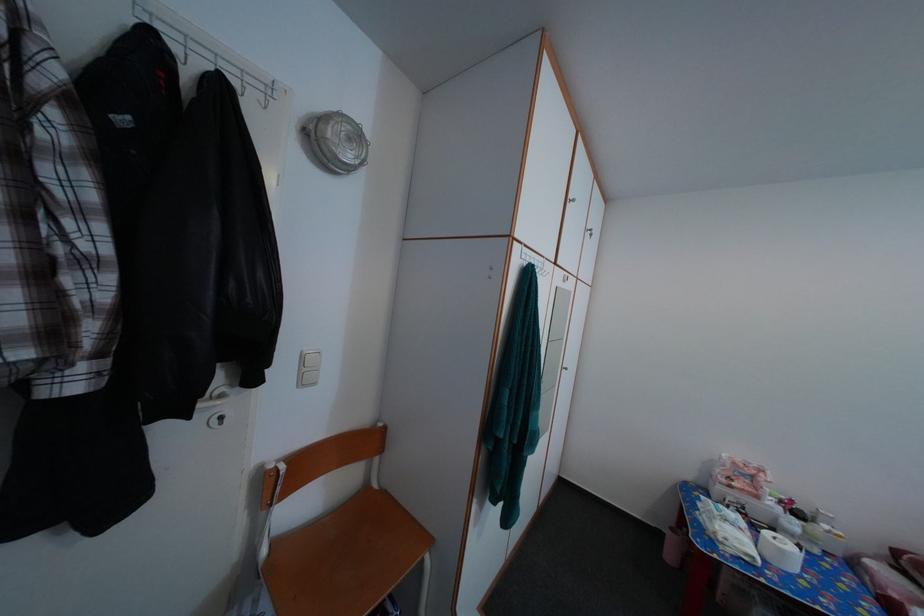
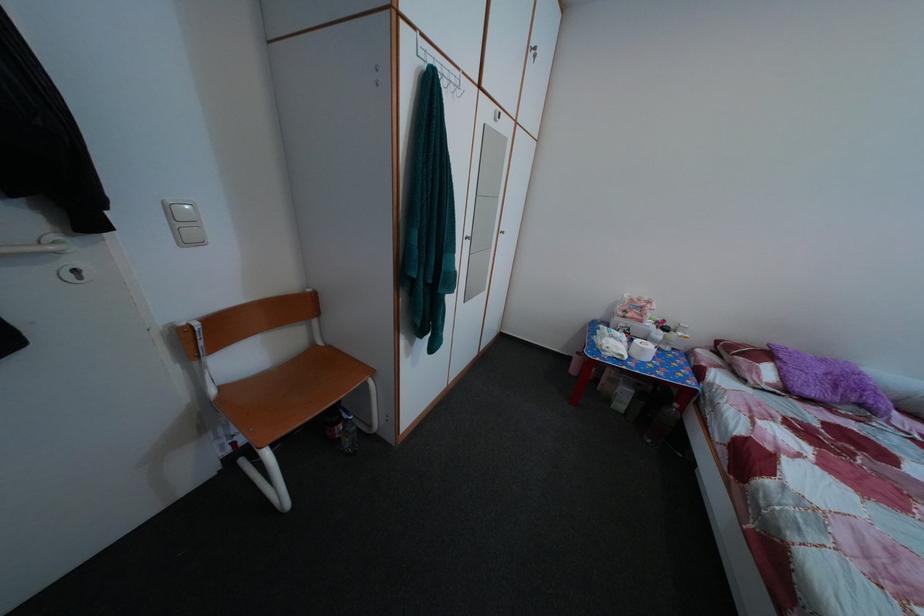
Question: The images are taken continuously from a first-person perspective. In which direction are you moving?

Choices:
 (A) Left
 (B) Right
 (C) Forward
 (D) Backward

Answer: (B)